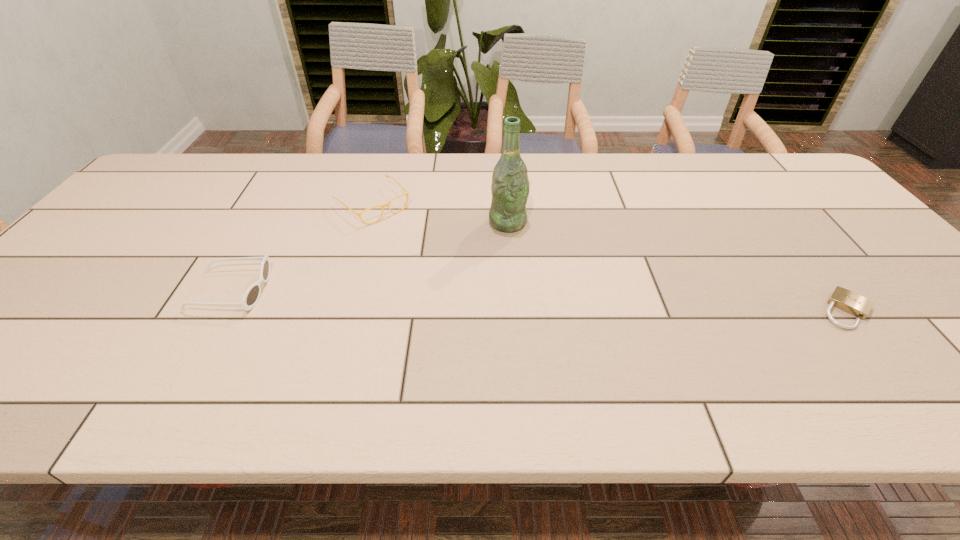
You are a GUI agent. You are given a task and a screenshot of the screen. Output one action in this format:
    pyautogui.click(x=<x>, y=<y>)
    Task: Click on the sunglasses
    This screenshot has height=540, width=960.
    Given the screenshot: What is the action you would take?
    pyautogui.click(x=252, y=294)

You are a GUI agent. You are given a task and a screenshot of the screen. Output one action in this format:
    pyautogui.click(x=<x>, y=<y>)
    Task: Click on the padlock
    This screenshot has width=960, height=540.
    Given the screenshot: What is the action you would take?
    pyautogui.click(x=844, y=299)

I want to click on the shortest object, so click(844, 299).

You are a GUI agent. You are given a task and a screenshot of the screen. Output one action in this format:
    pyautogui.click(x=<x>, y=<y>)
    Task: Click on the beer bottle
    Image resolution: width=960 pixels, height=540 pixels.
    Given the screenshot: What is the action you would take?
    coord(510,186)

The height and width of the screenshot is (540, 960). I want to click on the tallest object, so click(510, 186).

At what (x,y) coordinates should I click in order to perform the action: click on spectacles. Please return your answer as a coordinate pair (x, y). The height and width of the screenshot is (540, 960). Looking at the image, I should click on (386, 204).

This screenshot has height=540, width=960. Identify the location of vacant region located 0.070m with the lenses of the leftmost object facing outward. (296, 291).

At what (x,y) coordinates should I click in order to perform the action: click on free region located 0.290m on the back of the padlock. Please return your answer as a coordinate pair (x, y). Image resolution: width=960 pixels, height=540 pixels. Looking at the image, I should click on pos(772,218).

At what (x,y) coordinates should I click in order to perform the action: click on free spot located on the surface of the beer bottle. Please return your answer as a coordinate pair (x, y). This screenshot has width=960, height=540. Looking at the image, I should click on (543, 265).

Locate an element on the screen. The width and height of the screenshot is (960, 540). free region located on the surface of the beer bottle is located at coordinates (528, 246).